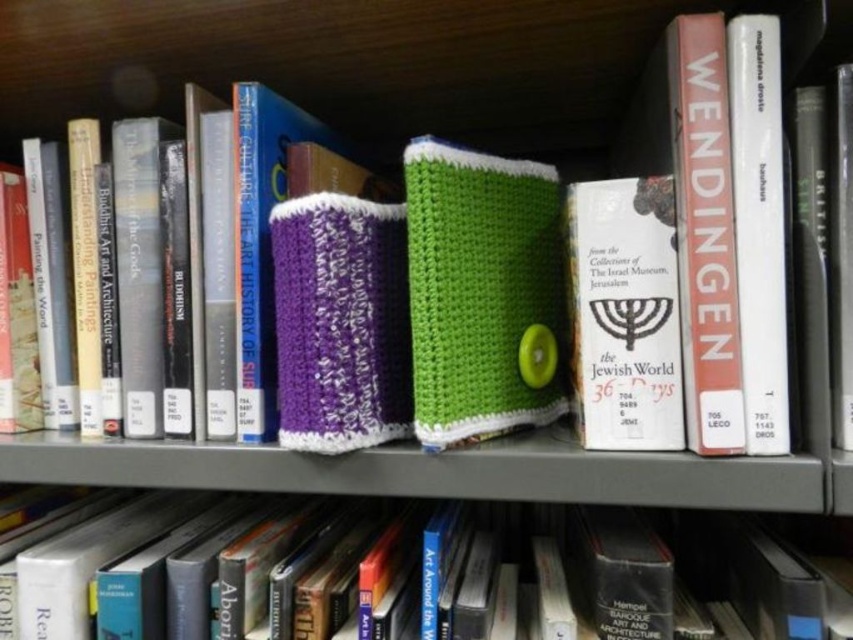
In the scene shown: You are standing 1 meter away from the bookshelf and want to reach the hardcover book at center. Can you grab it without moving closer?

The hardcover book at center is 52.50 centimeters away from the camera. Since you are standing 1 meter away, which is 100 centimeters, you are 47.5 centimeters away from the hardcover book at center. This distance is within typical arm reach for most people, so you can grab it without moving closer.

You are organizing books on a shelf and need to place the hardcover book at center and the white paper book at upper right. Which book requires more shelf space?

The hardcover book at center requires more shelf space because it is bigger than the white paper book at upper right.

You are standing 20 inches away from the bookshelf. Can you reach the point at coordinates point (779,580) without moving closer?

The point at coordinates point (779,580) is 21.24 inches away from the viewer. Since you are currently 20 inches away from the bookshelf, you are 1.24 inches too far to reach it without moving closer.